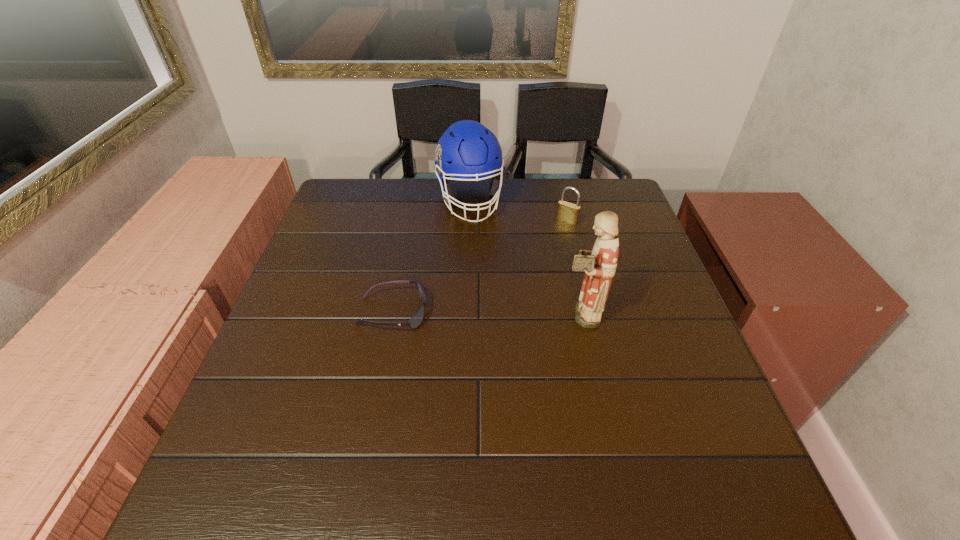
Identify the location of vacant space at the near left corner of the desktop. The height and width of the screenshot is (540, 960). (268, 409).

Identify the location of free space at the far right corner of the desktop. Image resolution: width=960 pixels, height=540 pixels. (590, 182).

Find the location of a particular element. Image resolution: width=960 pixels, height=540 pixels. vacant area at the near right corner of the desktop is located at coordinates (716, 438).

Locate an element on the screen. unoccupied area between the sunglasses and the figurine is located at coordinates (486, 313).

You are a GUI agent. You are given a task and a screenshot of the screen. Output one action in this format:
    pyautogui.click(x=<x>, y=<y>)
    Task: Click on the empty location between the shortest object and the second tallest object
    The height and width of the screenshot is (540, 960).
    Given the screenshot: What is the action you would take?
    pyautogui.click(x=431, y=256)

The width and height of the screenshot is (960, 540). Identify the location of vacant space that's between the shortest object and the third shortest object. (431, 256).

The height and width of the screenshot is (540, 960). Identify the location of vacant space that's between the padlock and the football helmet. (518, 211).

Where is `free spot between the shortest object and the figurine`? This screenshot has width=960, height=540. free spot between the shortest object and the figurine is located at coordinates click(486, 313).

This screenshot has width=960, height=540. I want to click on vacant region between the shortest object and the football helmet, so click(x=431, y=256).

You are a GUI agent. You are given a task and a screenshot of the screen. Output one action in this format:
    pyautogui.click(x=<x>, y=<y>)
    Task: Click on the vacant area that lies between the sunglasses and the football helmet
    This screenshot has width=960, height=540.
    Given the screenshot: What is the action you would take?
    pyautogui.click(x=431, y=256)